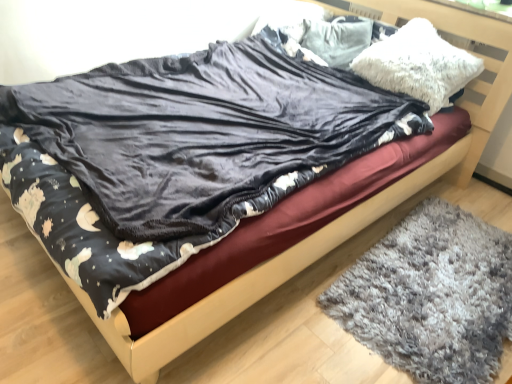
Question: From the image's perspective, is white fluffy pillow at upper right, the first pillow in the front-to-back sequence, located above or below white fluffy pillow at upper center, the 2th pillow positioned from the front?

Choices:
 (A) below
 (B) above

Answer: (A)

Question: Is point (408, 82) positioned closer to the camera than point (359, 29)?

Choices:
 (A) farther
 (B) closer

Answer: (B)

Question: Which is nearer to the wooden bed frame at center?

Choices:
 (A) velvet dark blue blanket at center
 (B) white fluffy pillow at upper right, the first pillow in the front-to-back sequence
 (C) white fluffy pillow at upper center, the 2th pillow positioned from the front
 (D) gray shaggy rug at lower right

Answer: (A)

Question: Considering the real-world distances, which object is closest to the wooden bed frame at center?

Choices:
 (A) white fluffy pillow at upper center, the 1th pillow in the back-to-front sequence
 (B) velvet dark blue blanket at center
 (C) gray shaggy rug at lower right
 (D) white fluffy pillow at upper right, the 2th pillow positioned from the back

Answer: (B)